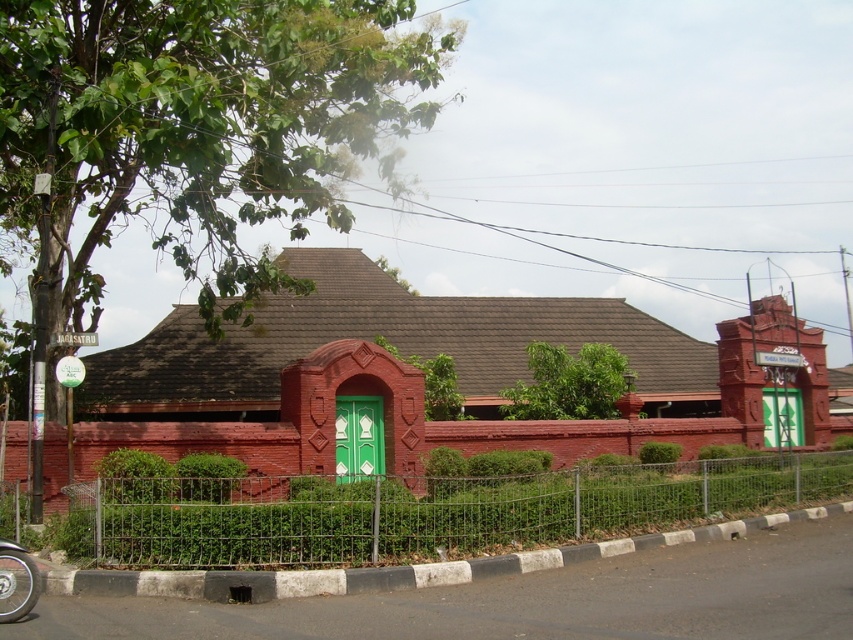
You are standing at the entrance of the red brick building and want to know the exact location of the metal wire fence at lower center. According to the coordinates provided, where is it positioned?

The metal wire fence at lower center is located at point (418, 512), which means it is positioned near the lower central part of the image.

From the picture: You are standing at the point marked by point (418, 512). Which object are you closest to?

You are closest to the metal wire fence at lower center because the point (418, 512) represents its location.